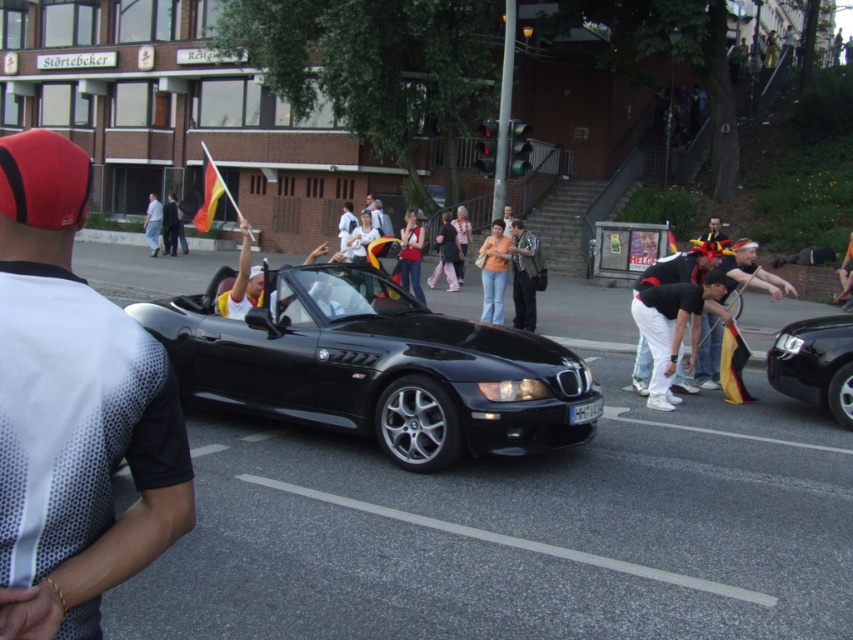
You are a fashion designer observing the parade scene. You notice the white cotton pants at center and the matte black jacket at center. Which clothing item appears smaller in size?

The white cotton pants at center has a smaller size compared to the matte black jacket at center.

You are a photographer standing in the middle of the street. You want to take a photo of the white mesh shirt at left. Where should you aim your camera to capture it?

You should aim your camera at the coordinates point (73,410) to capture the white mesh shirt at left.